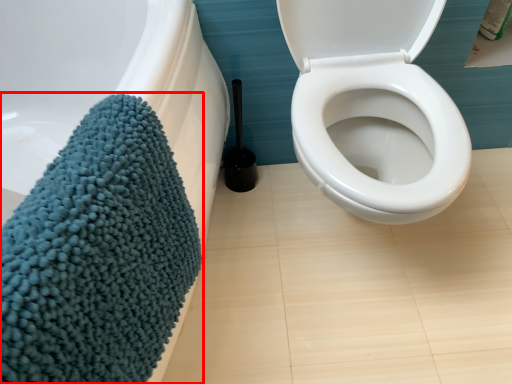
Question: From the image's perspective, what is the correct spatial positioning of bath towel (annotated by the red box) in reference to brush?

Choices:
 (A) above
 (B) below

Answer: (B)